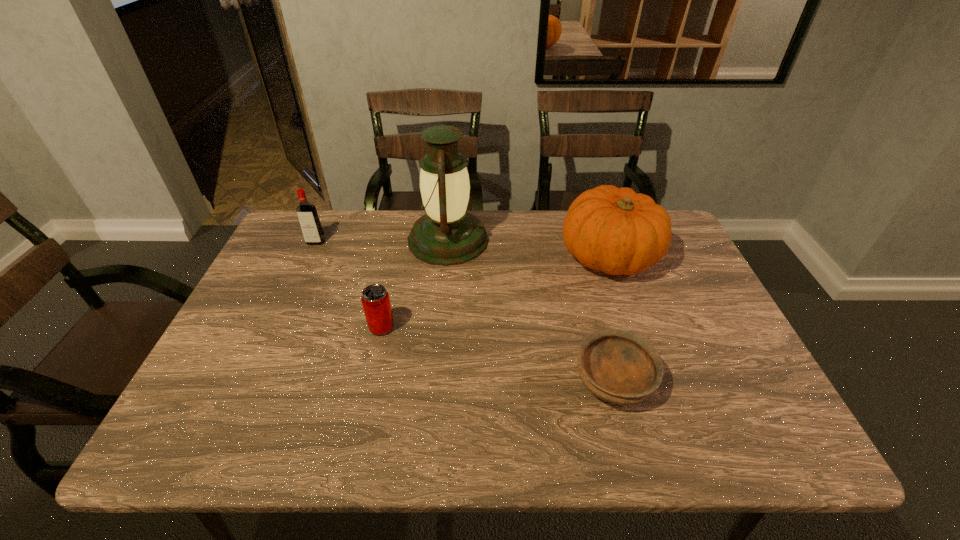
Find the location of a particular element. vacant space located 0.350m on the back of the fourth tallest object is located at coordinates (402, 235).

Where is `free space located 0.110m on the back of the bowl`? This screenshot has height=540, width=960. free space located 0.110m on the back of the bowl is located at coordinates (596, 314).

The image size is (960, 540). In order to click on lantern positioned at the far edge in this screenshot , I will do `click(447, 234)`.

The height and width of the screenshot is (540, 960). I want to click on pumpkin that is at the far edge, so click(614, 230).

Locate an element on the screen. The image size is (960, 540). vodka that is positioned at the far edge is located at coordinates (309, 221).

Identify the location of object located in the near edge section of the desktop. (619, 367).

Identify the location of object that is at the left edge. click(x=309, y=221).

Locate an element on the screen. The image size is (960, 540). object that is positioned at the right edge is located at coordinates (614, 230).

Locate an element on the screen. object that is at the far left corner is located at coordinates 309,221.

The image size is (960, 540). What are the coordinates of `object at the far right corner` in the screenshot? It's located at (614, 230).